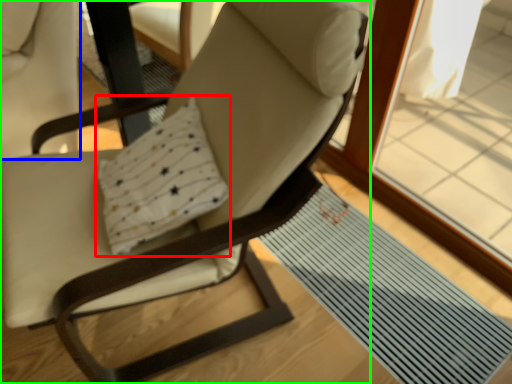
Question: Which object is the farthest from pillow (highlighted by a red box)? Choose among these: swivel chair (highlighted by a blue box) or chair (highlighted by a green box).

Choices:
 (A) swivel chair
 (B) chair

Answer: (A)